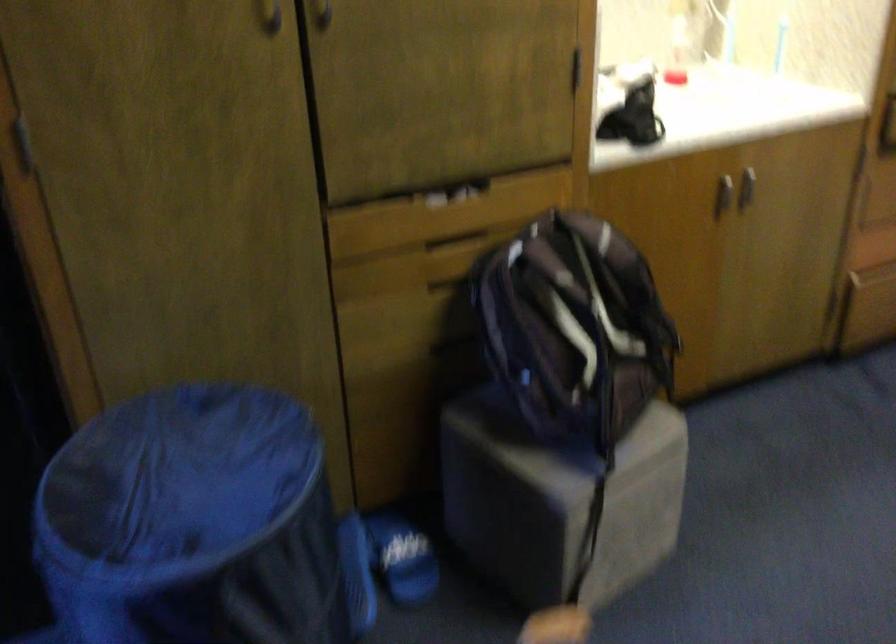
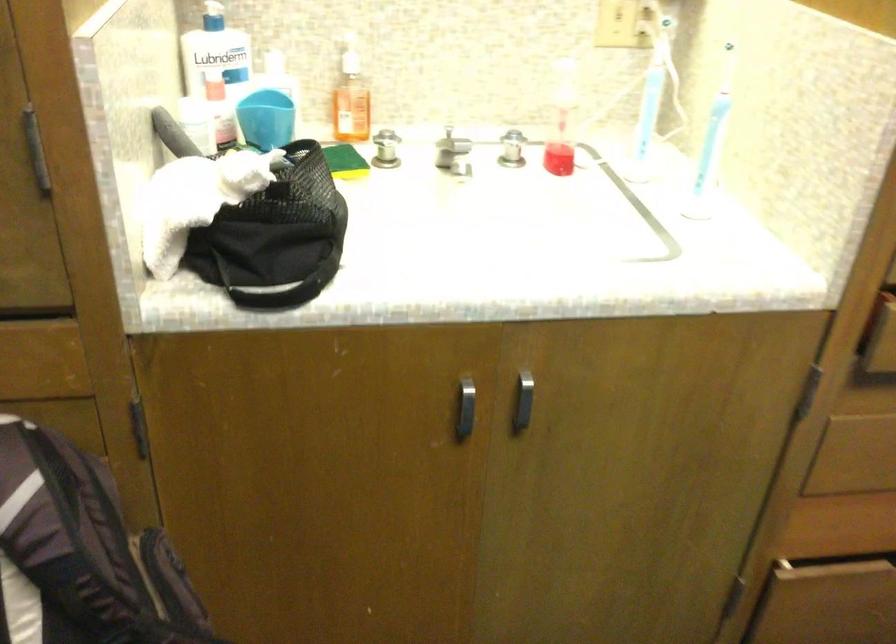
Find the pixel in the second image that matches point 725,187 in the first image.

(464, 409)